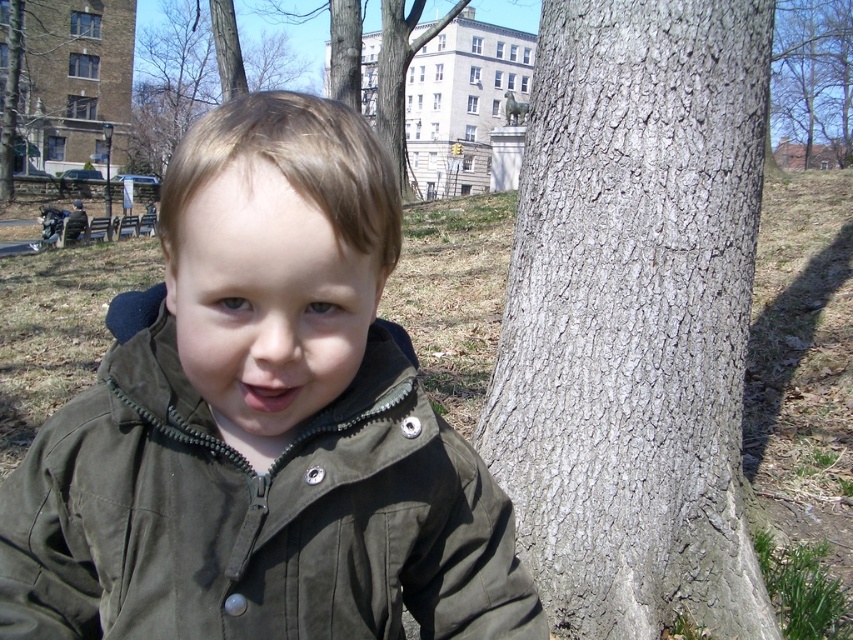
Is olive green fabric jacket at lower left shorter than brown rough bark tree at upper left?

Yes.

Does olive green fabric jacket at lower left appear on the left side of brown rough bark tree at upper left?

Incorrect, olive green fabric jacket at lower left is not on the left side of brown rough bark tree at upper left.

At what (x,y) coordinates should I click in order to perform the action: click on olive green fabric jacket at lower left. Please return your answer as a coordinate pair (x, y). Looking at the image, I should click on (254, 516).

Find the location of a particular element. The width and height of the screenshot is (853, 640). olive green fabric jacket at lower left is located at coordinates (254, 516).

Can you confirm if olive green fabric jacket at lower left is bigger than smooth bark tree at upper right?

Incorrect, olive green fabric jacket at lower left is not larger than smooth bark tree at upper right.

Which of these two, olive green fabric jacket at lower left or smooth bark tree at upper right, stands shorter?

olive green fabric jacket at lower left

Looking at this image, measure the distance between olive green fabric jacket at lower left and camera.

The distance of olive green fabric jacket at lower left from camera is 23.95 inches.

The height and width of the screenshot is (640, 853). I want to click on olive green fabric jacket at lower left, so click(254, 516).

Does gray rough bark at center have a larger size compared to brown rough bark tree at upper left?

No.

The height and width of the screenshot is (640, 853). What are the coordinates of `gray rough bark at center` in the screenshot? It's located at (634, 316).

The image size is (853, 640). I want to click on gray rough bark at center, so click(x=634, y=316).